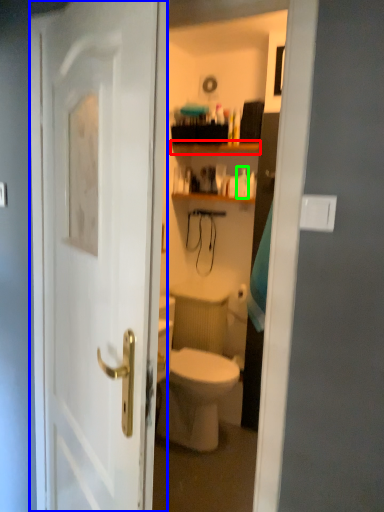
Question: Based on their relative distances, which object is nearer to shelf (highlighted by a red box)? Choose from door (highlighted by a blue box) and toiletry (highlighted by a green box).

Choices:
 (A) door
 (B) toiletry

Answer: (B)